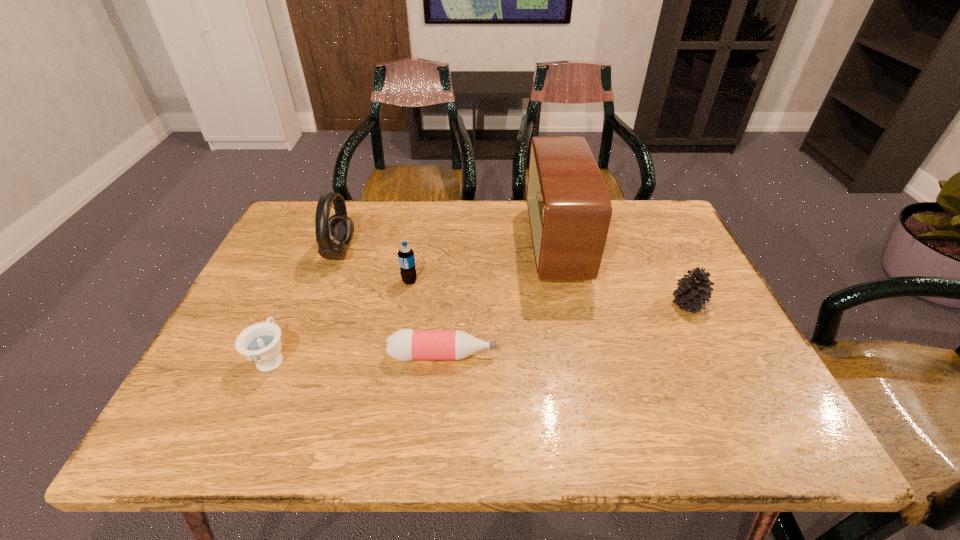
Locate an element on the screen. The height and width of the screenshot is (540, 960). radio receiver is located at coordinates (569, 208).

The image size is (960, 540). Identify the location of the tallest object. (569, 208).

Identify the location of headset. The height and width of the screenshot is (540, 960). coord(333,234).

Identify the location of soda bottle. The height and width of the screenshot is (540, 960). (406, 258).

This screenshot has height=540, width=960. In order to click on the rightmost object in this screenshot , I will do `click(693, 292)`.

At what (x,y) coordinates should I click in order to perform the action: click on pinecone. Please return your answer as a coordinate pair (x, y). The width and height of the screenshot is (960, 540). Looking at the image, I should click on (693, 292).

I want to click on teacup, so click(x=260, y=343).

Where is `the shortest object`? The width and height of the screenshot is (960, 540). the shortest object is located at coordinates (405, 345).

This screenshot has height=540, width=960. Identify the location of free space located 0.300m on the front-facing side of the radio receiver. (424, 244).

Where is `vacant space located on the front-facing side of the radio receiver`? vacant space located on the front-facing side of the radio receiver is located at coordinates (431, 244).